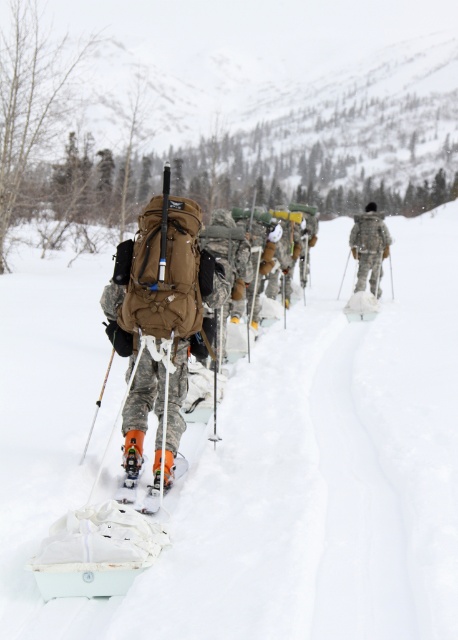
Question: Can you confirm if camouflage fabric backpack at center is smaller than orange matte ski at center?

Choices:
 (A) no
 (B) yes

Answer: (A)

Question: Is white matte snow at center to the right of orange matte ski at center from the viewer's perspective?

Choices:
 (A) yes
 (B) no

Answer: (A)

Question: Is white matte snow at center thinner than camouflage fabric backpack at center?

Choices:
 (A) yes
 (B) no

Answer: (B)

Question: Which point is farther to the camera?

Choices:
 (A) (146, 356)
 (B) (165, 474)

Answer: (A)

Question: Which object is positioned closest to the orange matte ski at center?

Choices:
 (A) white matte snow at center
 (B) camouflage fabric uniform at center

Answer: (A)

Question: Estimate the real-world distances between objects in this image. Which object is closer to the orange matte ski at center?

Choices:
 (A) white matte snow at center
 (B) camouflage fabric backpack at center

Answer: (B)